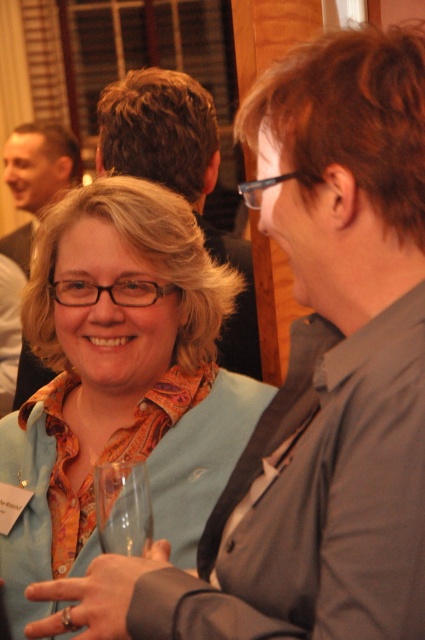
Who is positioned more to the left, matte orange shirt at center or matte black shirt at upper left?

From the viewer's perspective, matte black shirt at upper left appears more on the left side.

Which is in front, point (82, 524) or point (39, 141)?

Point (82, 524) is more forward.

Where is `matte orange shirt at center`? matte orange shirt at center is located at coordinates (119, 380).

Does matte orange shirt at center appear on the right side of brown hair at center?

In fact, matte orange shirt at center is to the left of brown hair at center.

Between point (172, 550) and point (176, 179), which one is positioned behind?

Positioned behind is point (176, 179).

Does point (34, 500) lie in front of point (235, 248)?

Yes, point (34, 500) is closer to viewer.

Image resolution: width=425 pixels, height=640 pixels. I want to click on matte orange shirt at center, so click(x=119, y=380).

Is matte orange shirt at center bigger than transparent glass at lower left?

Yes, matte orange shirt at center is bigger than transparent glass at lower left.

Can you confirm if matte orange shirt at center is thinner than transparent glass at lower left?

No.

At what (x,y) coordinates should I click in order to perform the action: click on matte orange shirt at center. Please return your answer as a coordinate pair (x, y). The height and width of the screenshot is (640, 425). Looking at the image, I should click on (119, 380).